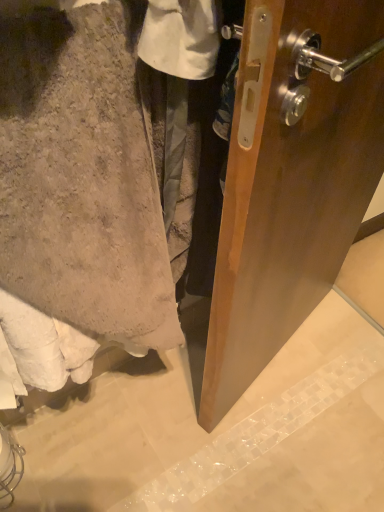
Question: Is beige fuzzy towel at lower left to the left of smooth concrete wall at lower left from the viewer's perspective?

Choices:
 (A) yes
 (B) no

Answer: (A)

Question: Would you say beige fuzzy towel at lower left contains smooth concrete wall at lower left?

Choices:
 (A) yes
 (B) no

Answer: (B)

Question: Does beige fuzzy towel at lower left have a greater height compared to smooth concrete wall at lower left?

Choices:
 (A) no
 (B) yes

Answer: (B)

Question: Can you confirm if beige fuzzy towel at lower left is thinner than smooth concrete wall at lower left?

Choices:
 (A) yes
 (B) no

Answer: (A)

Question: From a real-world perspective, is beige fuzzy towel at lower left physically below smooth concrete wall at lower left?

Choices:
 (A) yes
 (B) no

Answer: (B)

Question: Does beige fuzzy towel at lower left touch smooth concrete wall at lower left?

Choices:
 (A) yes
 (B) no

Answer: (B)

Question: From a real-world perspective, is smooth concrete wall at lower left physically above beige fuzzy towel at lower left?

Choices:
 (A) no
 (B) yes

Answer: (A)

Question: Is beige fuzzy towel at lower left a part of smooth concrete wall at lower left?

Choices:
 (A) no
 (B) yes

Answer: (A)

Question: Can you see smooth concrete wall at lower left touching beige fuzzy towel at lower left?

Choices:
 (A) no
 (B) yes

Answer: (A)

Question: Is smooth concrete wall at lower left facing away from beige fuzzy towel at lower left?

Choices:
 (A) yes
 (B) no

Answer: (B)

Question: Can you confirm if smooth concrete wall at lower left is thinner than beige fuzzy towel at lower left?

Choices:
 (A) no
 (B) yes

Answer: (A)

Question: Can you confirm if smooth concrete wall at lower left is wider than beige fuzzy towel at lower left?

Choices:
 (A) yes
 (B) no

Answer: (A)

Question: Is beige fuzzy towel at lower left spatially inside smooth concrete wall at lower left, or outside of it?

Choices:
 (A) inside
 (B) outside

Answer: (B)